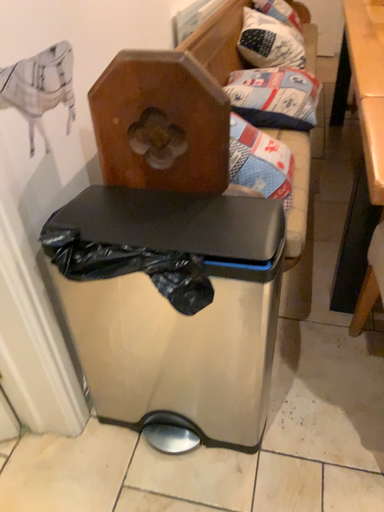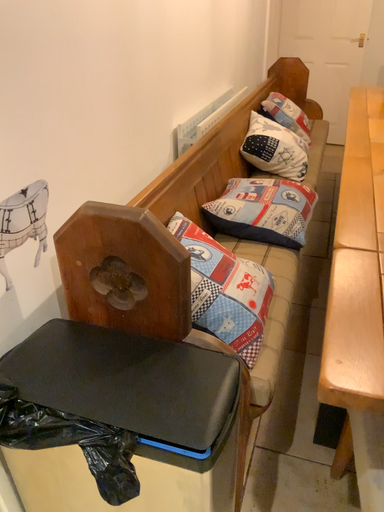
Question: How did the camera likely rotate when shooting the video?

Choices:
 (A) rotated downward
 (B) rotated upward

Answer: (B)